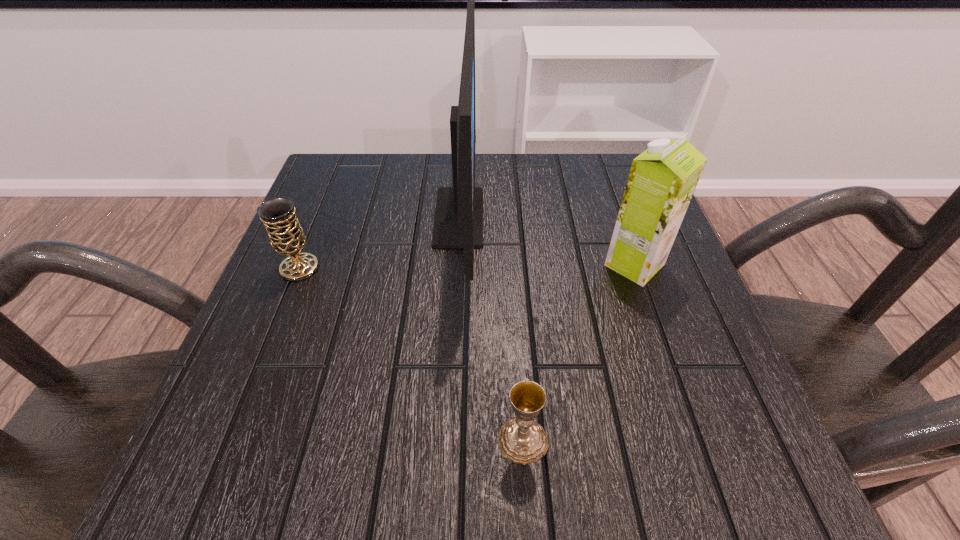
In order to click on vacant space that satisfies the following two spatial constraints: 1. on the back side of the third object from left to right; 2. on the screen side of the tallest object in this screenshot , I will do tap(508, 218).

The height and width of the screenshot is (540, 960). I want to click on free space in the image that satisfies the following two spatial constraints: 1. on the screen side of the computer monitor; 2. on the left side of the shortest object, so click(x=447, y=440).

Identify the location of vacant space that satisfies the following two spatial constraints: 1. on the screen side of the second object from right to left; 2. on the right side of the computer monitor. This screenshot has height=540, width=960. (447, 440).

This screenshot has height=540, width=960. In order to click on vacant region that satisfies the following two spatial constraints: 1. on the screen side of the tallest object; 2. on the front side of the second shortest object in this screenshot , I will do `click(456, 268)`.

This screenshot has width=960, height=540. In order to click on free point that satisfies the following two spatial constraints: 1. on the back side of the nearer chalice; 2. on the screen side of the second object from left to right in this screenshot , I will do `click(508, 218)`.

Locate an element on the screen. Image resolution: width=960 pixels, height=540 pixels. vacant position in the image that satisfies the following two spatial constraints: 1. on the front side of the left chalice; 2. on the right side of the shortest object is located at coordinates (230, 440).